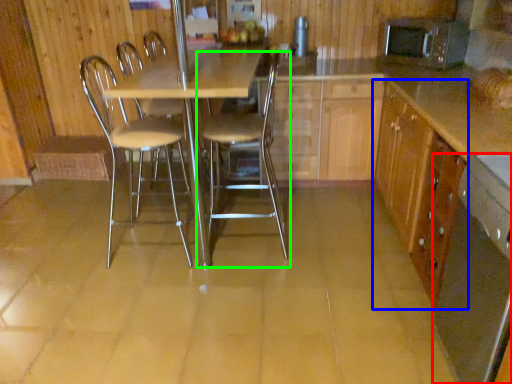
Question: Based on their relative distances, which object is farther from kitchen appliance (highlighted by a red box)? Choose from cabinetry (highlighted by a blue box) and chair (highlighted by a green box).

Choices:
 (A) cabinetry
 (B) chair

Answer: (B)